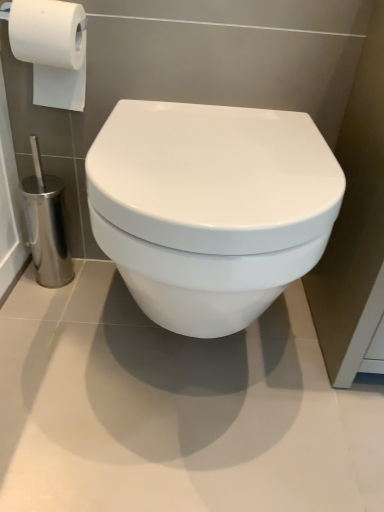
Question: Relative to white glossy toilet at center, is white matte toilet paper at upper left in front or behind?

Choices:
 (A) front
 (B) behind

Answer: (B)

Question: Considering the positions of point (81, 94) and point (158, 314), is point (81, 94) closer or farther from the camera than point (158, 314)?

Choices:
 (A) closer
 (B) farther

Answer: (B)

Question: From the image's perspective, is white matte toilet paper at upper left positioned above or below white glossy toilet at center?

Choices:
 (A) above
 (B) below

Answer: (A)

Question: In terms of size, does white glossy toilet at center appear bigger or smaller than white matte toilet paper at upper left?

Choices:
 (A) small
 (B) big

Answer: (B)

Question: Relative to white matte toilet paper at upper left, is white glossy toilet at center in front or behind?

Choices:
 (A) behind
 (B) front

Answer: (B)

Question: Is point (329, 222) positioned closer to the camera than point (33, 82)?

Choices:
 (A) closer
 (B) farther

Answer: (A)

Question: In the image, is white glossy toilet at center on the left side or the right side of white matte toilet paper at upper left?

Choices:
 (A) right
 (B) left

Answer: (A)